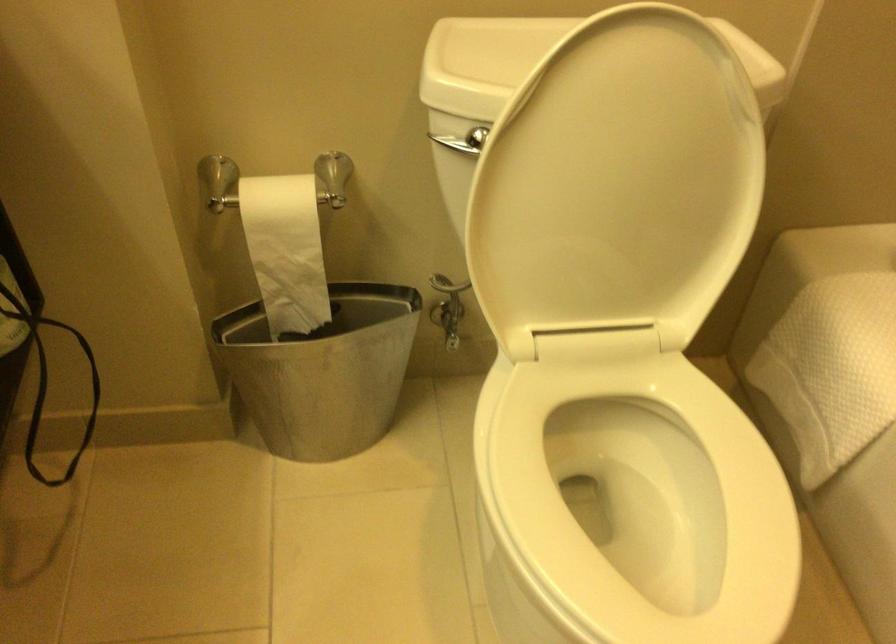
Where would you lift the white toilet seat? Please return your answer as a coordinate pair (x, y).

(630, 504)